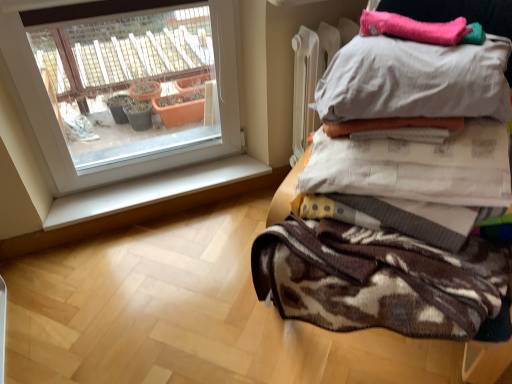
Find the location of a particular element. vacant space situated above white cotton pillow at upper right (from a real-world perspective) is located at coordinates 429,39.